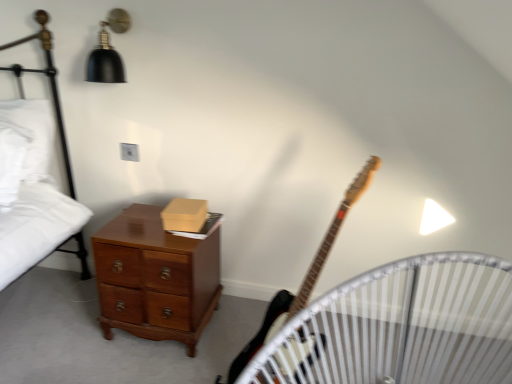
Question: From their relative heights in the image, would you say matte brown box at center is taller or shorter than wooden electric guitar at center-right?

Choices:
 (A) short
 (B) tall

Answer: (A)

Question: Would you say matte brown box at center is to the left or to the right of wooden electric guitar at center-right in the picture?

Choices:
 (A) left
 (B) right

Answer: (A)

Question: Which object is positioned closest to the wooden crib at lower left?

Choices:
 (A) white soft pillow at left
 (B) matte brown box at center
 (C) black matte lampshade at upper left
 (D) wooden electric guitar at center-right
 (E) white cotton bed at left

Answer: (D)

Question: Which object is the closest to the black matte lampshade at upper left?

Choices:
 (A) wooden crib at lower left
 (B) wooden electric guitar at center-right
 (C) matte brown box at center
 (D) white soft pillow at left
 (E) mahogany wooden chest of drawers at lower left

Answer: (D)